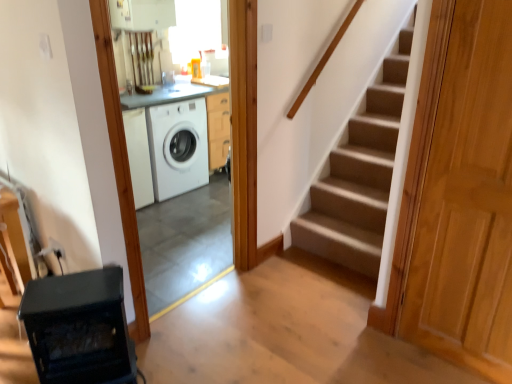
Question: Is light brown wooden door at right to the left of white glossy washing machine at center from the viewer's perspective?

Choices:
 (A) yes
 (B) no

Answer: (B)

Question: Is light brown wooden door at right outside of white glossy washing machine at center?

Choices:
 (A) yes
 (B) no

Answer: (A)

Question: Is light brown wooden door at right shorter than white glossy washing machine at center?

Choices:
 (A) yes
 (B) no

Answer: (A)

Question: From the image's perspective, is light brown wooden door at right under white glossy washing machine at center?

Choices:
 (A) yes
 (B) no

Answer: (A)

Question: Can you confirm if light brown wooden door at right is positioned to the right of white glossy washing machine at center?

Choices:
 (A) yes
 (B) no

Answer: (A)

Question: Would you say white glossy washing machine at center is to the left or to the right of black glass stove at lower left in the picture?

Choices:
 (A) right
 (B) left

Answer: (A)

Question: Relative to black glass stove at lower left, is white glossy washing machine at center in front or behind?

Choices:
 (A) front
 (B) behind

Answer: (B)

Question: Is white glossy washing machine at center bigger or smaller than black glass stove at lower left?

Choices:
 (A) small
 (B) big

Answer: (B)

Question: Considering the positions of white glossy washing machine at center and black glass stove at lower left in the image, is white glossy washing machine at center wider or thinner than black glass stove at lower left?

Choices:
 (A) thin
 (B) wide

Answer: (A)

Question: From their relative heights in the image, would you say black glass stove at lower left is taller or shorter than light brown wooden door at right?

Choices:
 (A) short
 (B) tall

Answer: (A)

Question: In the image, is black glass stove at lower left positioned in front of or behind light brown wooden door at right?

Choices:
 (A) behind
 (B) front

Answer: (A)

Question: From a real-world perspective, is black glass stove at lower left positioned above or below light brown wooden door at right?

Choices:
 (A) above
 (B) below

Answer: (B)

Question: Would you say black glass stove at lower left is inside or outside light brown wooden door at right?

Choices:
 (A) outside
 (B) inside

Answer: (A)

Question: Is black glass stove at lower left in front of or behind white glossy washing machine at center in the image?

Choices:
 (A) front
 (B) behind

Answer: (A)

Question: In terms of height, does black glass stove at lower left look taller or shorter compared to white glossy washing machine at center?

Choices:
 (A) tall
 (B) short

Answer: (B)